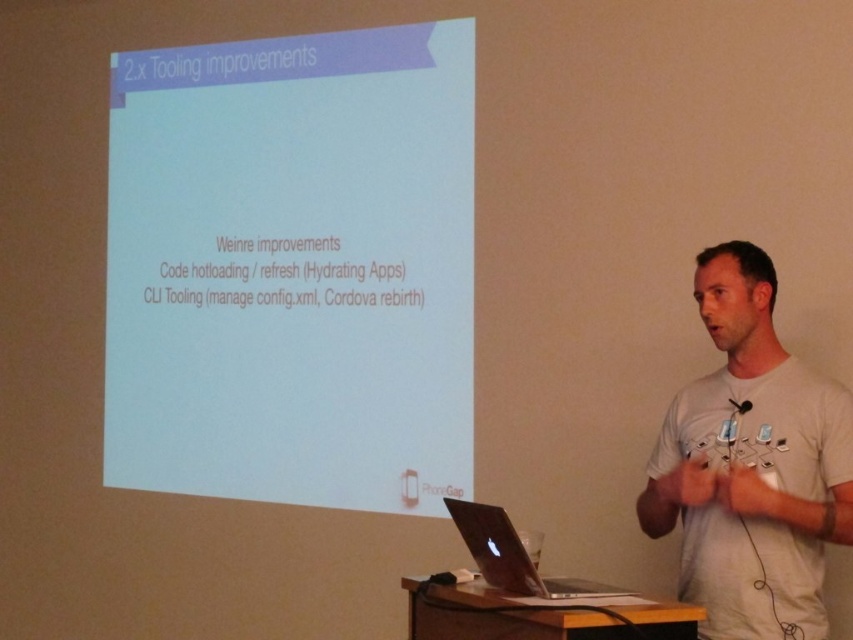
You are sitting in the audience and want to look at the silver metallic laptop at center and then glance at the white matte projector screen at upper center. Which object will require you to look upward more?

The white matte projector screen at upper center is located higher up than the silver metallic laptop at center, so you will need to look upward more to glance at the white matte projector screen at upper center.